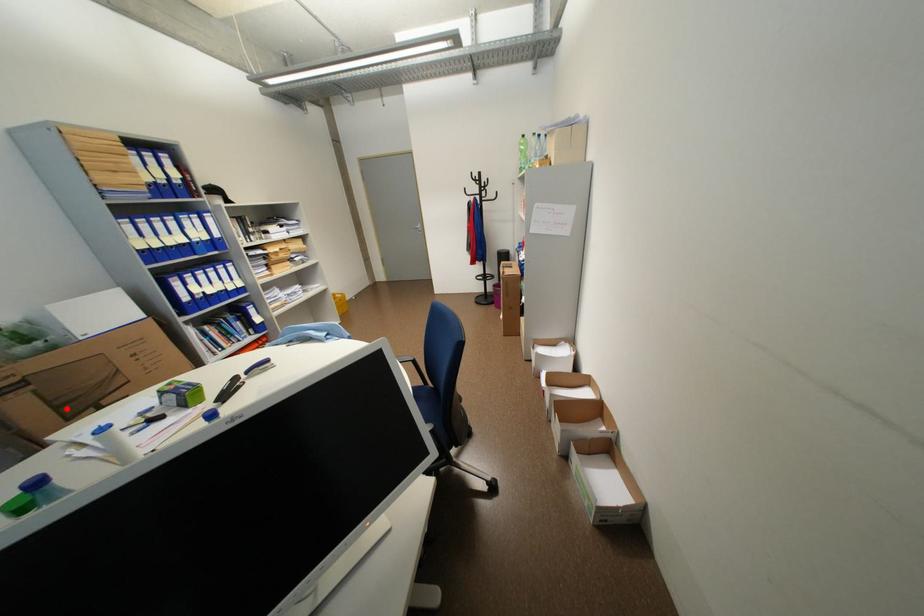
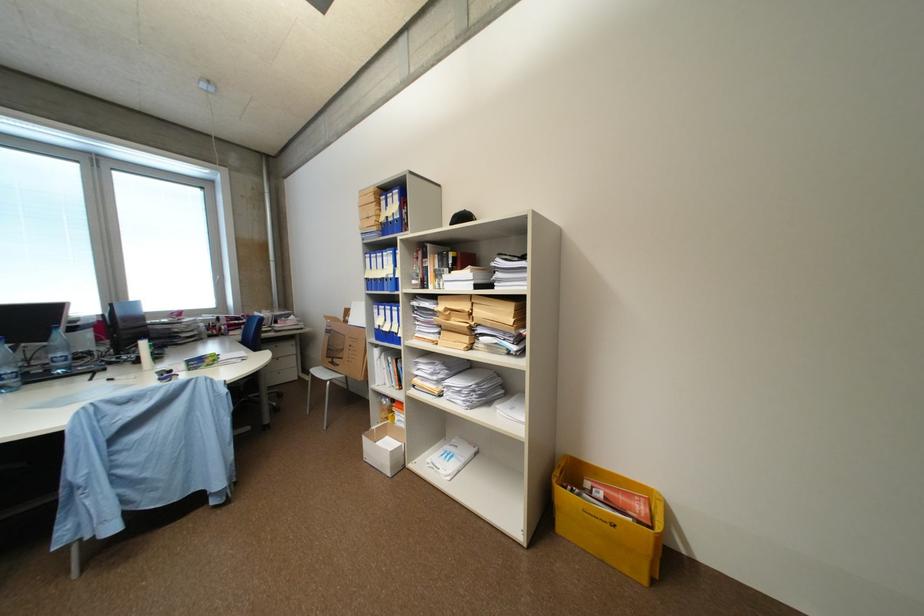
Locate, in the second image, the point that corresponds to the highlighted location in the first image.

(336, 350)